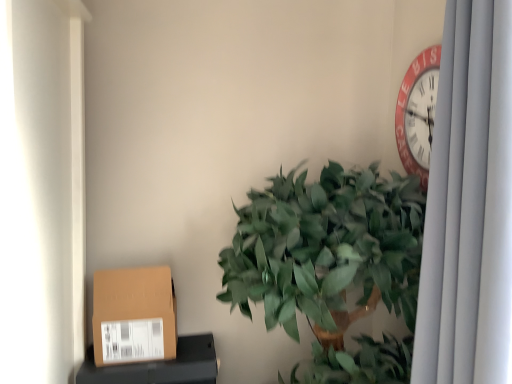
Question: From a real-world perspective, relative to brown cardboard box at lower left, is green leafy plant at center vertically above or below?

Choices:
 (A) below
 (B) above

Answer: (B)

Question: Considering the positions of green leafy plant at center and brown cardboard box at lower left in the image, is green leafy plant at center wider or thinner than brown cardboard box at lower left?

Choices:
 (A) wide
 (B) thin

Answer: (A)

Question: Which of these objects is positioned farthest from the brown cardboard box at lower left?

Choices:
 (A) brown cardboard box at lower left
 (B) green leafy plant at center
 (C) white fabric curtain at right

Answer: (C)

Question: Estimate the real-world distances between objects in this image. Which object is closer to the green leafy plant at center?

Choices:
 (A) brown cardboard box at lower left
 (B) white fabric curtain at right
 (C) brown cardboard box at lower left

Answer: (B)